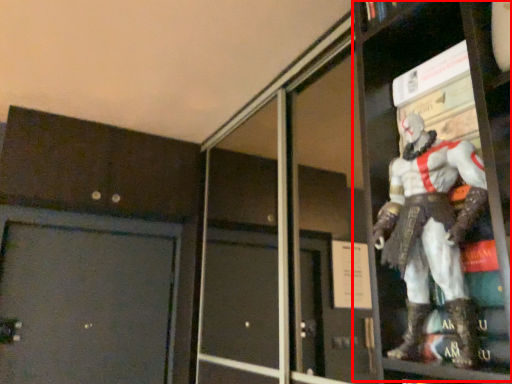
Question: From the image's perspective, where is shelf (annotated by the red box) located relative to screen door?

Choices:
 (A) above
 (B) below

Answer: (A)